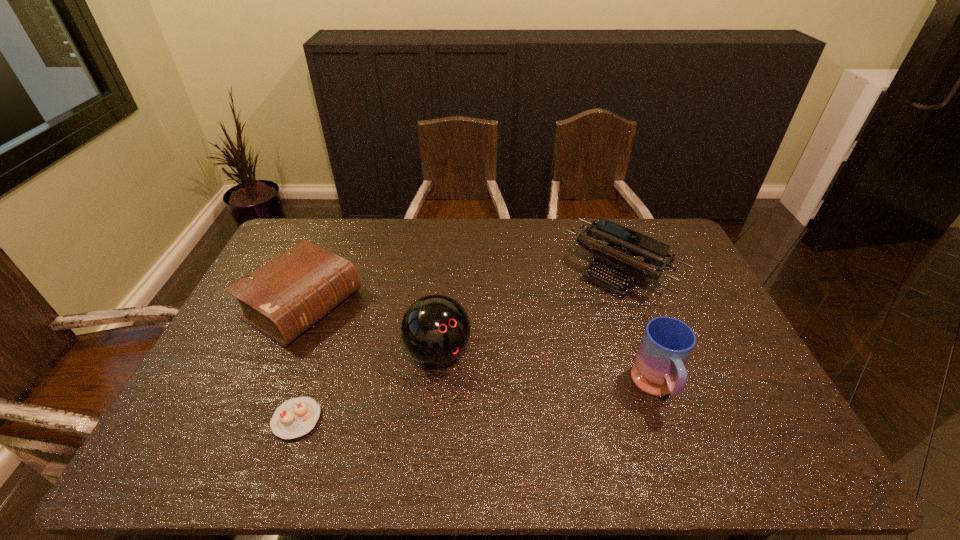
This screenshot has width=960, height=540. Identify the location of free space that is in between the Bible and the bowling ball. (371, 329).

The height and width of the screenshot is (540, 960). I want to click on free spot between the second shortest object and the cupcake, so click(300, 362).

The height and width of the screenshot is (540, 960). I want to click on vacant area that lies between the typewriter and the fourth tallest object, so click(462, 288).

You are a GUI agent. You are given a task and a screenshot of the screen. Output one action in this format:
    pyautogui.click(x=<x>, y=<y>)
    Task: Click on the free area in between the Bible and the typewriter
    The image size is (960, 540).
    Given the screenshot: What is the action you would take?
    pyautogui.click(x=462, y=288)

The height and width of the screenshot is (540, 960). Find the location of `unoccupied position between the mug and the fourth tallest object`. unoccupied position between the mug and the fourth tallest object is located at coordinates (480, 346).

This screenshot has height=540, width=960. What are the coordinates of `vacant area that lies between the third object from right to left and the second shortest object` in the screenshot? It's located at (371, 329).

Select which object is the closest to the mug. Please provide its 2D coordinates. Your answer should be formatted as a tuple, i.e. [(x, y)], where the tuple contains the x and y coordinates of a point satisfying the conditions above.

[(614, 252)]

Locate an element on the screen. Image resolution: width=960 pixels, height=540 pixels. the fourth closest object to the Bible is located at coordinates (667, 343).